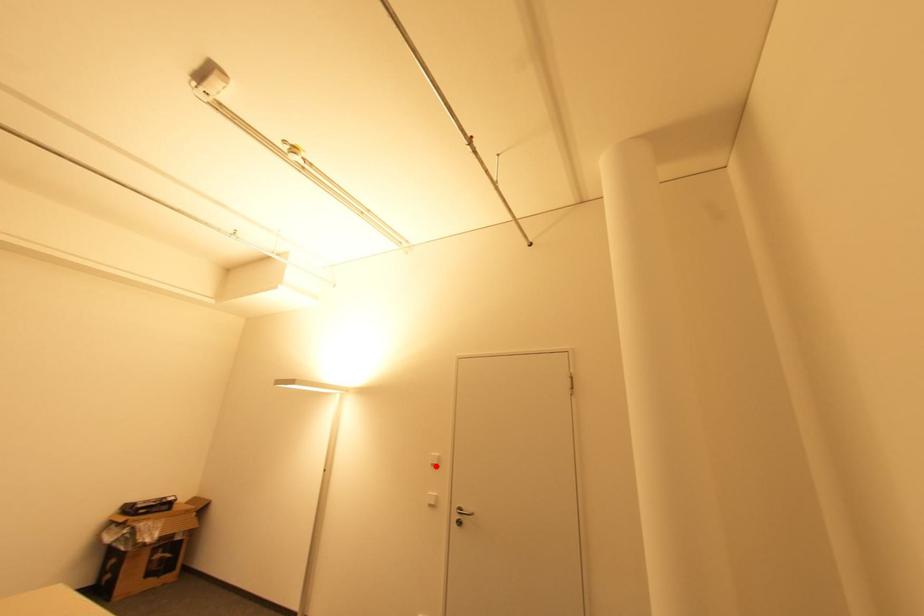
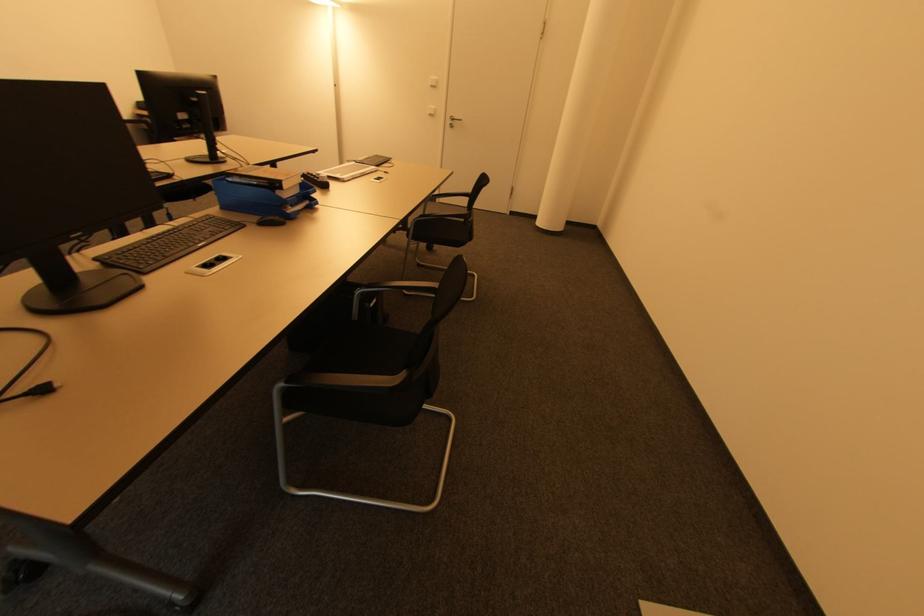
Find the pixel in the second image that matches the highlighted location in the first image.

(434, 87)